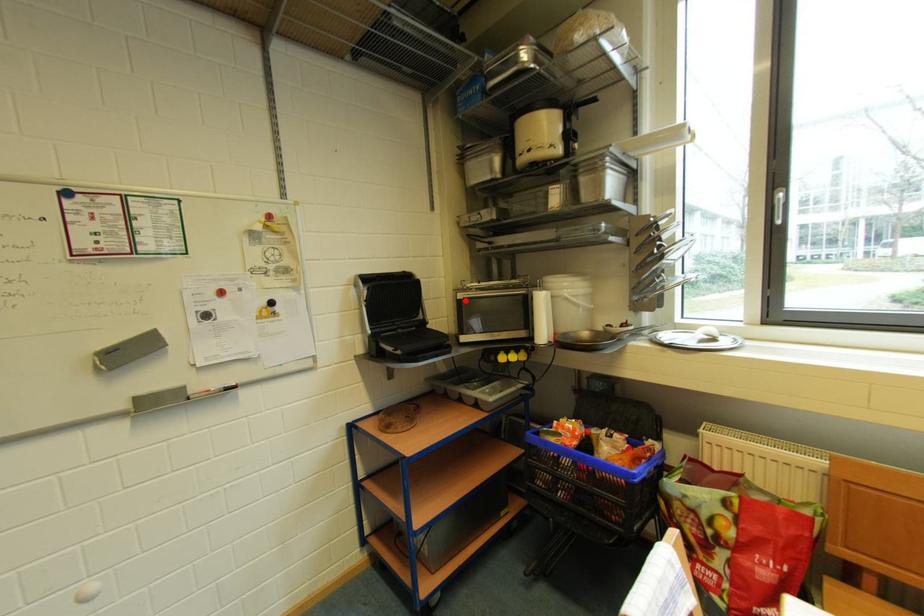
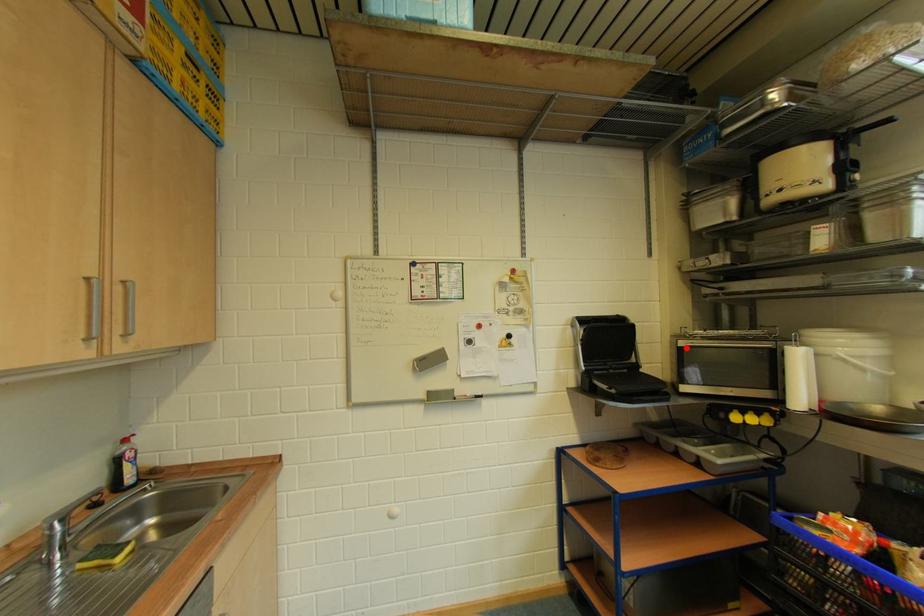
I am providing you with two images of the same scene from different viewpoints. A red point is marked on the first image and another point is marked on the second image. Are the points marked in image1 and image2 representing the same 3D position?

Yes